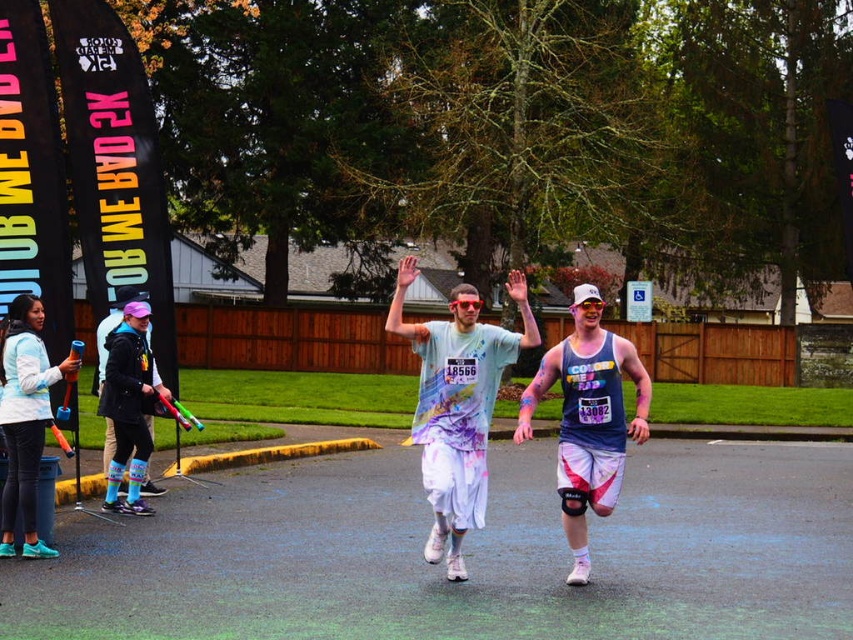
You are a photographer at the 2K run event and need to capture the matte blue tank top at center. Based on its position, where should you aim your camera?

The matte blue tank top at center is located at point 0.655 on the x and 0.691 on the y axis, so aim your camera at those coordinates for the best shot.